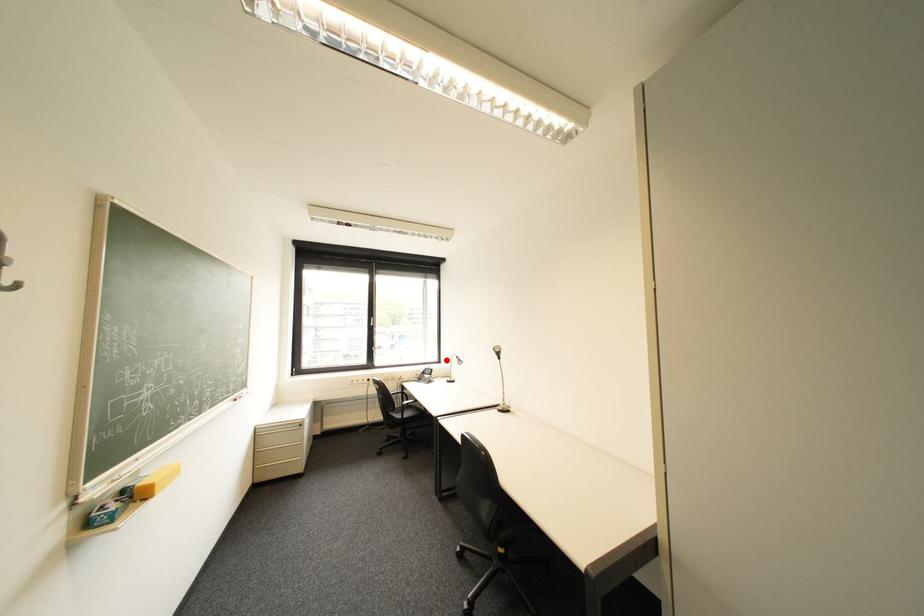
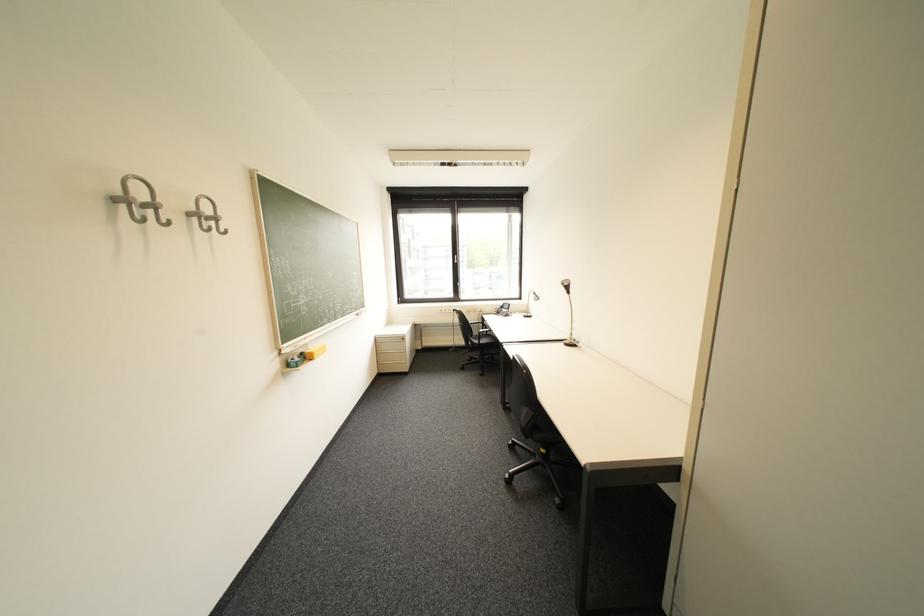
Locate, in the second image, the point that corresponds to the highlighted location in the first image.

(528, 297)